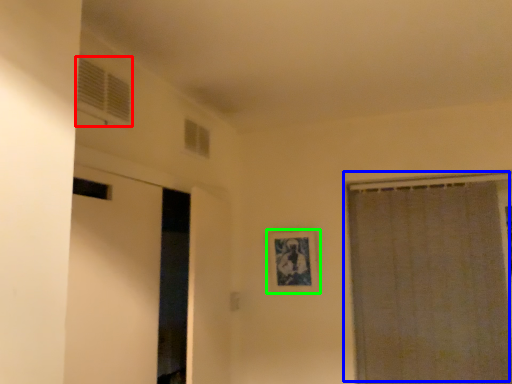
Question: Considering the real-world distances, which object is farthest from window (highlighted by a red box)? curtain (highlighted by a blue box) or picture frame (highlighted by a green box)?

Choices:
 (A) curtain
 (B) picture frame

Answer: (A)